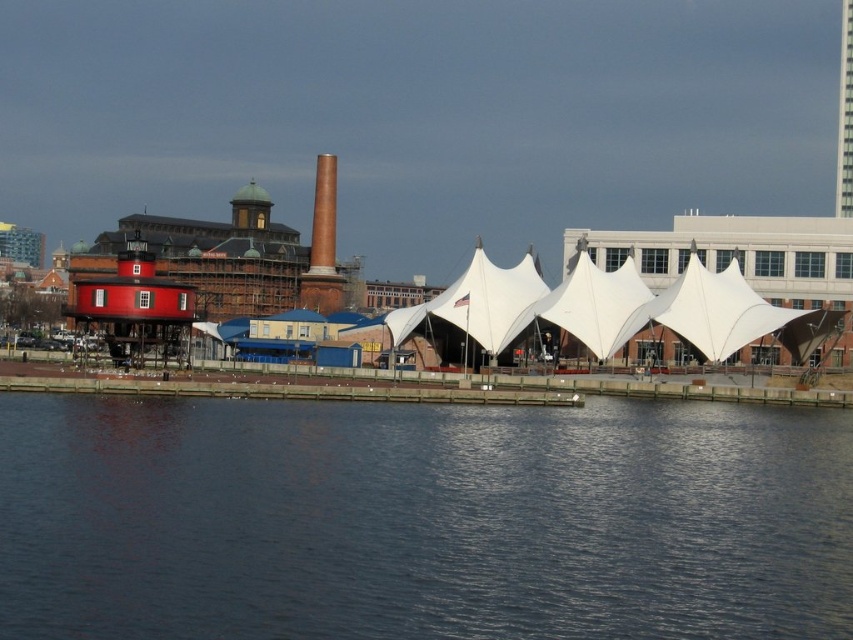
You are a visitor at the waterfront and want to take a photo that includes both the white fabric tent at center and the white fabric canopy at center. Which one should you focus on to ensure both are in the frame without moving the camera?

You should focus on the white fabric tent at center because it is bigger and will be more visible in the frame, allowing the smaller white fabric canopy at center to also fit into the photo.

You are standing on the wooden pier and looking towards the red lighthouse. Which object is closer to the water surface between the dark blue water at lower center and the white fabric canopy at center?

The dark blue water at lower center is closer to the water surface since it is shorter than the white fabric canopy at center.